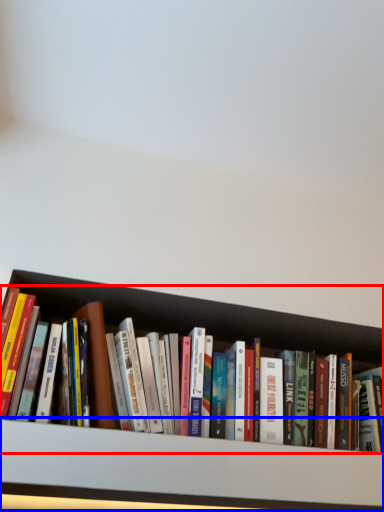
Question: Which point is further to the camera, book (highlighted by a red box) or cabinet (highlighted by a blue box)?

Choices:
 (A) book
 (B) cabinet

Answer: (A)